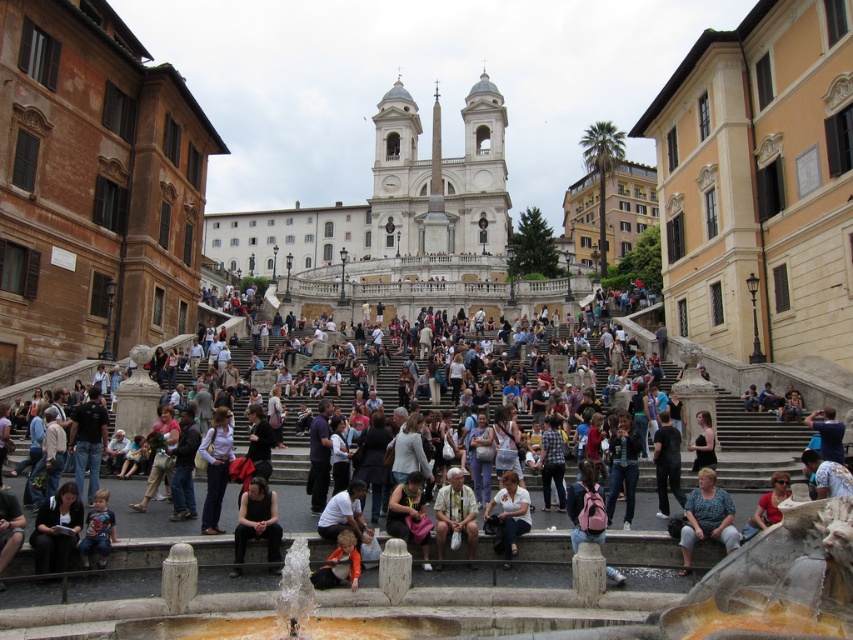
You are a photographer standing at the Spanish Steps and want to capture both the dark gray fabric jacket at lower left and the white cotton shirt at center in a single shot. Which clothing item will appear larger in the photo?

The dark gray fabric jacket at lower left will appear larger in the photo because it is closer to the camera than the white cotton shirt at center.

You are standing at the Spanish Steps in Rome and want to take a photo of the stone fountain at lower center. The camera you have can focus on objects up to 20 meters away. Will the fountain be in focus?

The stone fountain at lower center is 19.20 meters from camera, so yes, the camera can focus on it since it is within the 20 meters range.

You are standing at the Spanish Steps and want to take a photo of both the point at coordinates point [70,490] and point [500,499]. Which point should you focus on first to ensure both are in the frame?

You should focus on point [70,490] first since it is closer to the viewer, allowing both points to be captured in the frame.